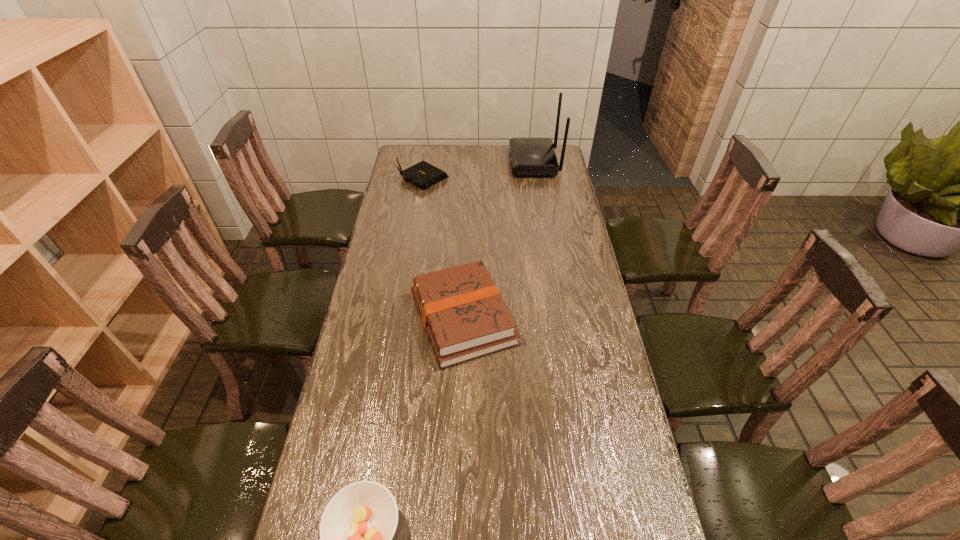
Locate an element on the screen. The image size is (960, 540). the tallest object is located at coordinates (529, 156).

I want to click on the taller router, so click(529, 156).

This screenshot has height=540, width=960. What are the coordinates of `the left router` in the screenshot? It's located at (422, 174).

Where is `the second nearest object`? The width and height of the screenshot is (960, 540). the second nearest object is located at coordinates pos(462,311).

I want to click on vacant region located on the front-facing side of the tallest object, so click(469, 162).

You are a GUI agent. You are given a task and a screenshot of the screen. Output one action in this format:
    pyautogui.click(x=<x>, y=<y>)
    Task: Click on the vacant space located 0.160m on the front-facing side of the tallest object
    The width and height of the screenshot is (960, 540).
    Given the screenshot: What is the action you would take?
    pyautogui.click(x=477, y=162)

This screenshot has height=540, width=960. Find the location of `vacant area situated 0.320m on the front-facing side of the tallest object`. vacant area situated 0.320m on the front-facing side of the tallest object is located at coordinates (444, 162).

Locate an element on the screen. Image resolution: width=960 pixels, height=540 pixels. free point located 0.060m on the front of the left router is located at coordinates (420, 200).

I want to click on free space located 0.200m on the front of the second nearest object, so click(x=459, y=434).

Where is `object located at the left edge`? This screenshot has width=960, height=540. object located at the left edge is located at coordinates (422, 174).